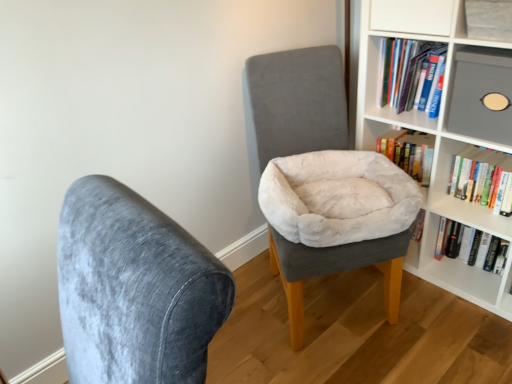
Question: From the image's perspective, is matte gray shelf at upper right, which appears as the second shelf when ordered from the bottom, located above or below velvet gray chair at center, the 2th chair positioned from the left?

Choices:
 (A) below
 (B) above

Answer: (B)

Question: In terms of height, does matte gray shelf at upper right, which appears as the 1th shelf when viewed from the top, look taller or shorter compared to velvet gray chair at center, the 2th chair positioned from the left?

Choices:
 (A) tall
 (B) short

Answer: (B)

Question: Which object is positioned closest to the white matte bookcase at upper right?

Choices:
 (A) beige plush bean bag chair at center
 (B) hardcover book at upper right, which is counted as the 2th book, starting from the bottom
 (C) velvet gray chair at center, positioned as the 1th chair in left-to-right order
 (D) matte gray shelf at upper right, which appears as the second shelf when ordered from the bottom
 (E) matte gray shelf at upper right, which is the second shelf in top-to-bottom order

Answer: (E)

Question: Considering the real-world distances, which object is farthest from the hardcover book at upper right, the second book viewed from the top?

Choices:
 (A) velvet gray chair at center, which ranks as the 1th chair in right-to-left order
 (B) white matte bookcase at upper right
 (C) matte gray shelf at upper right, which is counted as the 1th shelf, starting from the bottom
 (D) velvet gray chair at center, acting as the second chair starting from the back
 (E) matte gray shelf at upper right, which appears as the 1th shelf when viewed from the top

Answer: (D)